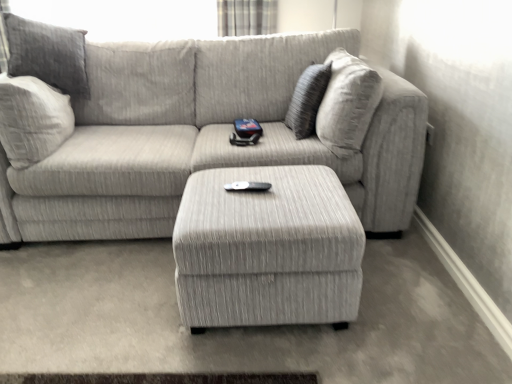
Identify the location of empty space that is ontop of textured gray ottoman at center (from a real-world perspective). (270, 190).